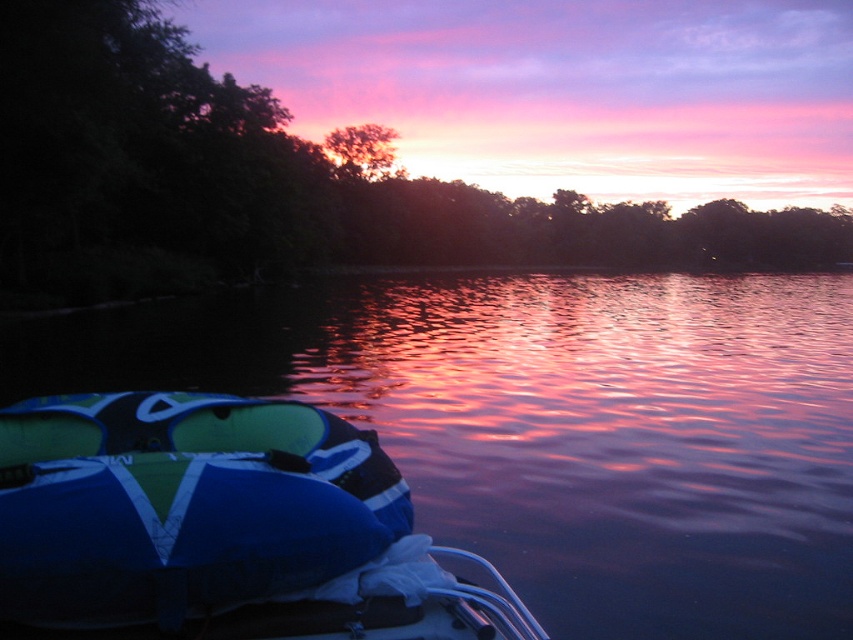
You are an observer looking at the sunset scene. You notice two trees at the center of the horizon. Which tree is closer to you, the green leafy tree at center or the silhouetted tree at center?

The green leafy tree at center is closer to you because it is in front of the silhouetted tree at center, which is further away.

You are standing on the dock where the blue fabric boat at lower left is located and want to reach the silhouetted tree at center. Considering the distance between them, can you walk directly to the tree from the boat without entering the water?

The blue fabric boat at lower left is 111.94 meters away from the silhouetted tree at center. Since the distance is quite large and the scene shows the tree at the horizon, it is likely across the water. Walking directly would require crossing the water, which is not possible on foot. Therefore, you cannot walk directly to the silhouetted tree at center from the blue fabric boat at lower left without entering the water.

You are standing at the edge of the water in the sunset scene and want to place a small buoy between the two points marked as point (616,577) and point (32,598). Which point is closer to you so that the buoy can be placed in front of it?

Point (32,598) is closer to you, so placing the buoy in front of it would position it nearer to your current location.